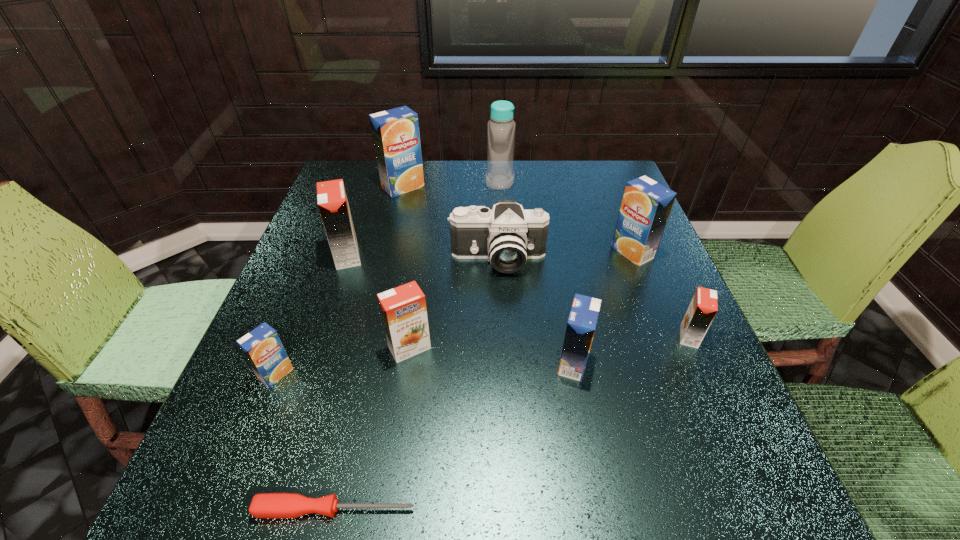
You are a GUI agent. You are given a task and a screenshot of the screen. Output one action in this format:
    pyautogui.click(x=<x>, y=<y>)
    Task: Click on the free space located on the back of the second orange orange juice from left to right
    
    Given the screenshot: What is the action you would take?
    pyautogui.click(x=425, y=240)

Identify the location of vacant region located 0.120m on the front of the second blue orange_juice from right to left. (588, 446).

You are a GUI agent. You are given a task and a screenshot of the screen. Output one action in this format:
    pyautogui.click(x=<x>, y=<y>)
    Task: Click on the vacant space situated 0.250m on the back of the smallest orange orange juice
    This screenshot has width=960, height=540.
    Given the screenshot: What is the action you would take?
    pyautogui.click(x=650, y=247)

Locate an element on the screen. The height and width of the screenshot is (540, 960). vacant region located 0.190m on the front of the leftmost blue orange_juice is located at coordinates (225, 501).

Where is `free region located 0.210m at the tip of the nearest object`? The image size is (960, 540). free region located 0.210m at the tip of the nearest object is located at coordinates (560, 509).

Where is `bottle located at the far edge`? bottle located at the far edge is located at coordinates (501, 128).

The image size is (960, 540). In order to click on orange_juice situated at the far edge in this screenshot , I will do `click(395, 132)`.

Locate an element on the screen. The width and height of the screenshot is (960, 540). object located at the near edge is located at coordinates (264, 505).

The image size is (960, 540). What are the coordinates of `screwdriver located in the left edge section of the desktop` in the screenshot? It's located at (264, 505).

Identify the location of object at the far left corner. This screenshot has height=540, width=960. (395, 132).